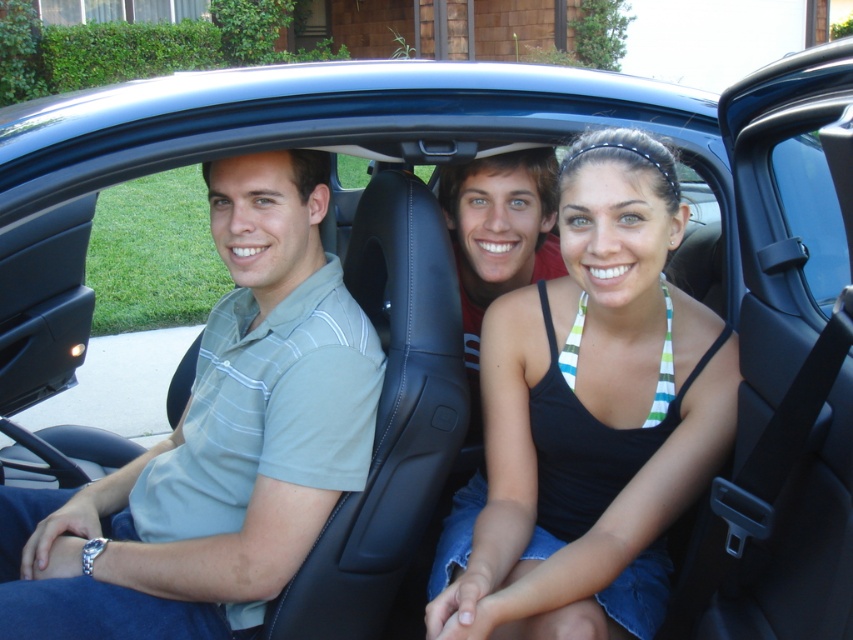
Based on the photo, can you confirm if black tank top at center is positioned to the right of gray striped polo shirt at left?

Yes, black tank top at center is to the right of gray striped polo shirt at left.

Between black tank top at center and gray striped polo shirt at left, which one appears on the left side from the viewer's perspective?

From the viewer's perspective, gray striped polo shirt at left appears more on the left side.

Where is `black tank top at center`? The height and width of the screenshot is (640, 853). black tank top at center is located at coordinates (589, 417).